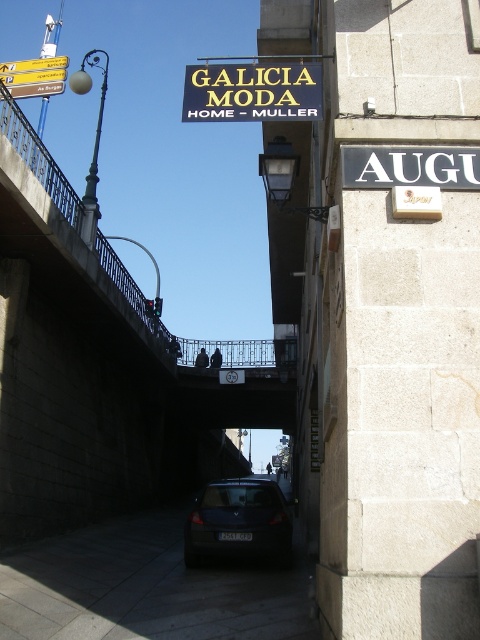
You are a delivery person trying to drive a 2.5 meter wide truck through the street under the concrete bridge at upper center. The truck is as wide as the dark gray matte car at center. Can the truck pass under the bridge without hitting it?

The concrete bridge at upper center is positioned over the dark gray matte car at center, which means the truck can pass under the bridge as long as it stays within the space where the car is parked. Since the truck is as wide as the car, it should fit without hitting the bridge.

You are standing at the entrance of the street and want to take a photo of the concrete bridge at upper center. If your camera can focus up to 30 feet away, will you need to adjust your position to capture the bridge clearly?

The concrete bridge at upper center is 33.45 feet away from the camera, which is beyond the camera focus limit of 30 feet. You need to move closer to ensure the bridge is in focus.